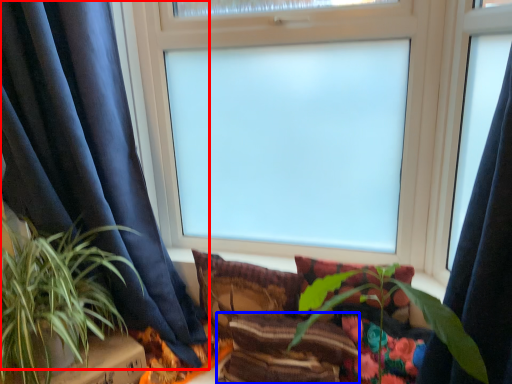
Question: Among these objects, which one is nearest to the camera, curtain (highlighted by a red box) or pillow (highlighted by a blue box)?

Choices:
 (A) curtain
 (B) pillow

Answer: (A)